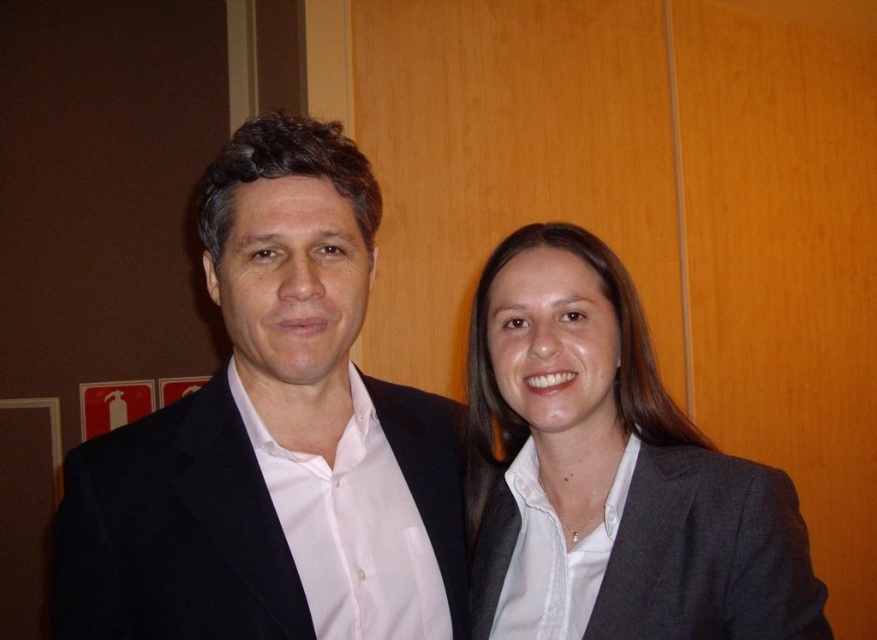
You are a photographer trying to position a new subject exactly where the black matte suit at center was in the image. What coordinates should you use for the new subject?

The coordinates for the black matte suit at center are at point (261, 424), so you should position the new subject at those coordinates.

You are standing in the room and want to move from the point at coordinates point (384, 400) to the point at coordinates point (696, 477). Can you walk directly between them without any obstacles?

Point (384, 400) is behind point (696, 477), so you cannot walk directly between them without passing behind the point at (696, 477) first.

You are standing in a room with two points marked on the floor. The first point is at coordinates point (305,300) and the second point is at point (752,499). If you want to walk from the first point to the second point, which direction should you move relative to the room?

To move from point (305,300) to point (752,499), you should move diagonally towards the upper right direction in the room since point (305,300) is in front of point (752,499).